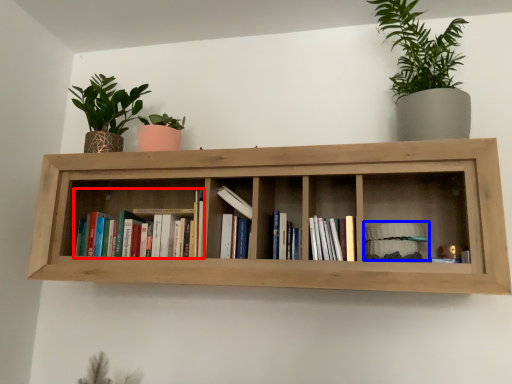
Question: Which point is closer to the camera, book (highlighted by a red box) or book (highlighted by a blue box)?

Choices:
 (A) book
 (B) book

Answer: (B)